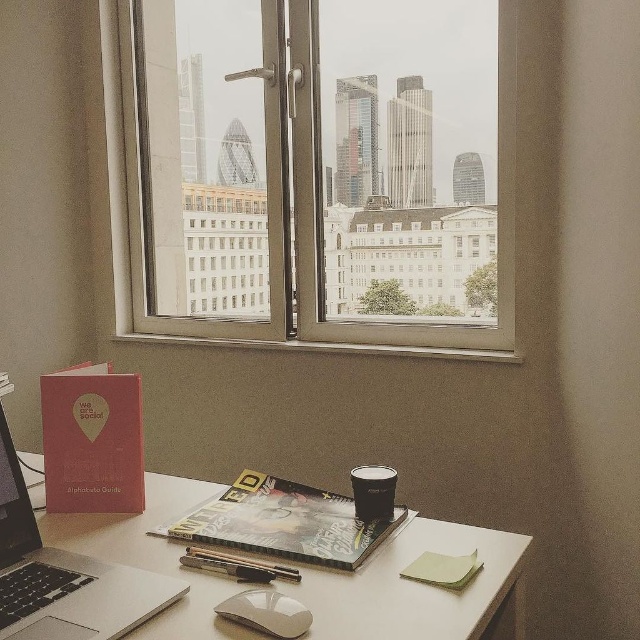
You are organizing items on your desk and want to stack the silver metallic laptop at lower left and the black matte coffee cup at center. Which item should you place at the bottom to ensure stability?

The silver metallic laptop at lower left is taller than the black matte coffee cup at center, so you should place the silver metallic laptop at lower left at the bottom for stability.

You are organizing the desk and want to place a new item between the silver metallic laptop at lower left and the black matte coffee cup at center. Is there enough vertical space between them to fit a 3cm tall object?

The silver metallic laptop at lower left is positioned under the black matte coffee cup at center, so there is vertical space between them. A 3cm tall object can fit between them vertically.

You are a delivery robot with a package that is 20 inches wide. You need to place it on the desk between the silver metallic laptop at lower left and the black matte coffee cup at center. Can you fit the package between them?

The distance between the silver metallic laptop at lower left and the black matte coffee cup at center is 19.23 inches. Since the package is 20 inches wide, it cannot fit between them as the space is narrower than the package.